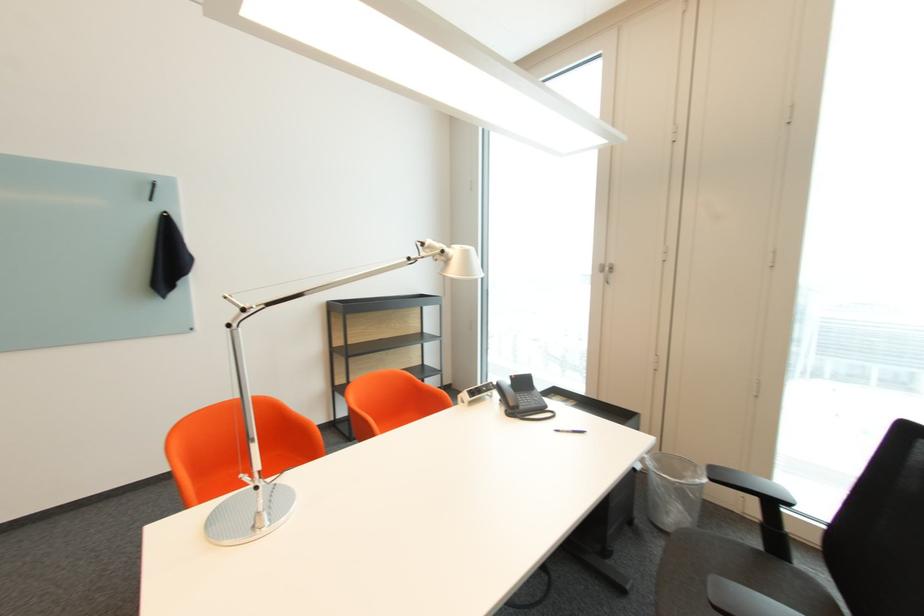
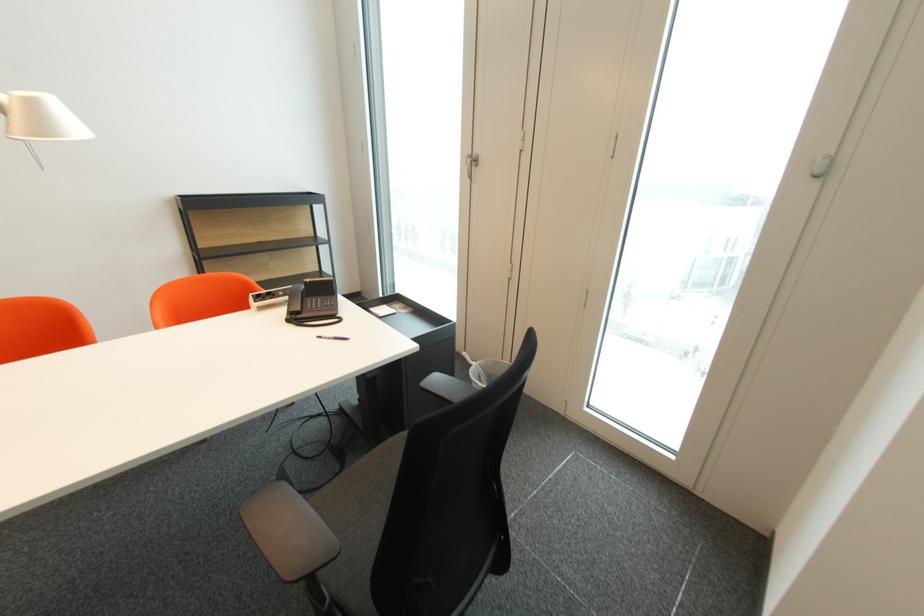
The point at (574, 432) is marked in the first image. Where is the corresponding point in the second image?

(336, 339)